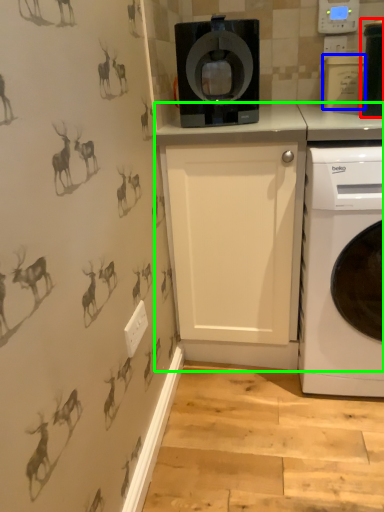
Question: Which is farther away from appliance (highlighted by a red box)? appliance (highlighted by a blue box) or counter (highlighted by a green box)?

Choices:
 (A) appliance
 (B) counter

Answer: (B)